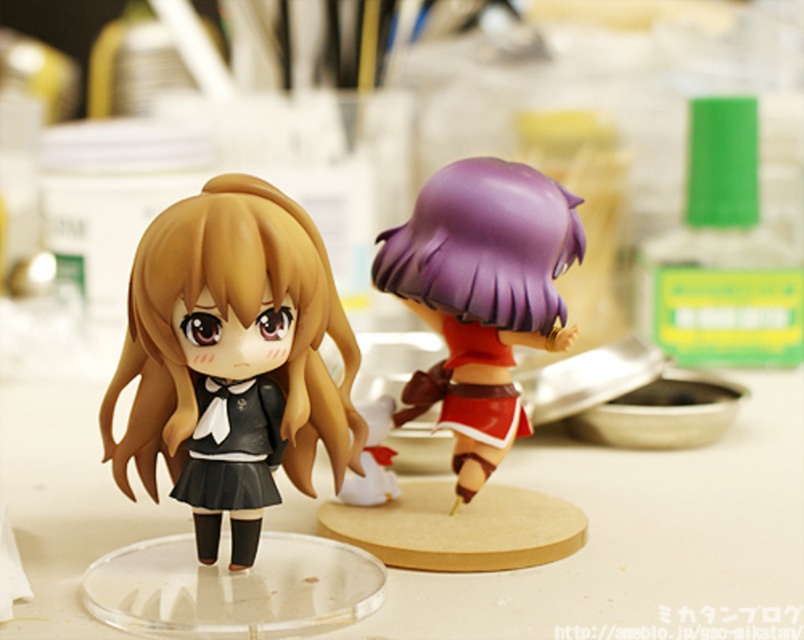
Who is positioned more to the left, white plastic table at center or purple glossy figurine at center?

purple glossy figurine at center

Which is behind, point (80, 529) or point (562, 269)?

Point (80, 529)

The height and width of the screenshot is (640, 804). Identify the location of white plastic table at center. (643, 540).

Consider the image. Can you confirm if white plastic table at center is positioned to the left of matte black doll at left?

No, white plastic table at center is not to the left of matte black doll at left.

Is white plastic table at center smaller than matte black doll at left?

Incorrect, white plastic table at center is not smaller in size than matte black doll at left.

Between point (494, 636) and point (289, 221), which one is positioned behind?

The point (289, 221) is behind.

At what (x,y) coordinates should I click in order to perform the action: click on white plastic table at center. Please return your answer as a coordinate pair (x, y). Looking at the image, I should click on (643, 540).

From the picture: Which of these two, matte black doll at left or purple glossy figurine at center, stands taller?

Standing taller between the two is purple glossy figurine at center.

Between point (195, 324) and point (470, 288), which one is positioned behind?

The point (470, 288) is more distant.

Does point (338, 348) come in front of point (491, 412)?

Yes.

Identify the location of matte black doll at left. Image resolution: width=804 pixels, height=640 pixels. (x=232, y=348).